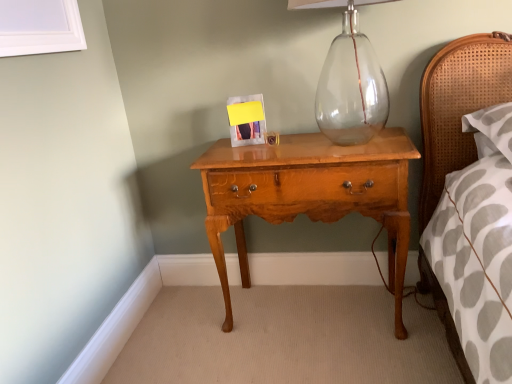
Where is `light brown wood nightstand at center`? This screenshot has width=512, height=384. light brown wood nightstand at center is located at coordinates (309, 194).

Describe the element at coordinates (309, 194) in the screenshot. I see `light brown wood nightstand at center` at that location.

What is the approximate width of yellow paper at center?

It is 2.78 inches.

Where is `yellow paper at center`? yellow paper at center is located at coordinates (246, 120).

Describe the element at coordinates (246, 120) in the screenshot. I see `yellow paper at center` at that location.

Where is `light brown wood nightstand at center`? light brown wood nightstand at center is located at coordinates (309, 194).

Considering the positions of objects yellow paper at center and light brown wood nightstand at center in the image provided, who is more to the right, yellow paper at center or light brown wood nightstand at center?

Positioned to the right is light brown wood nightstand at center.

From the picture: Between yellow paper at center and light brown wood nightstand at center, which one is positioned in front?

light brown wood nightstand at center.

Which point is more distant from viewer, (262, 116) or (388, 253)?

The point (388, 253) is farther from the camera.

From the image's perspective, between yellow paper at center and light brown wood nightstand at center, who is located below?

light brown wood nightstand at center, from the image's perspective.

From a real-world perspective, which object rests below the other?

In real-world perspective, light brown wood nightstand at center is lower.

Looking at their sizes, would you say yellow paper at center is wider or thinner than light brown wood nightstand at center?

Clearly, yellow paper at center has less width compared to light brown wood nightstand at center.

Considering the sizes of yellow paper at center and light brown wood nightstand at center in the image, is yellow paper at center taller or shorter than light brown wood nightstand at center?

yellow paper at center is shorter than light brown wood nightstand at center.

Based on their sizes in the image, would you say yellow paper at center is bigger or smaller than light brown wood nightstand at center?

Clearly, yellow paper at center is smaller in size than light brown wood nightstand at center.

Would you say yellow paper at center contains light brown wood nightstand at center?

No, light brown wood nightstand at center is located outside of yellow paper at center.

Is yellow paper at center not near light brown wood nightstand at center?

Actually, yellow paper at center and light brown wood nightstand at center are a little close together.

Is light brown wood nightstand at center at the back of yellow paper at center?

No, yellow paper at center is not facing the opposite direction of light brown wood nightstand at center.

How many degrees apart are the facing directions of yellow paper at center and light brown wood nightstand at center?

4.24 degrees separate the facing orientations of yellow paper at center and light brown wood nightstand at center.

This screenshot has height=384, width=512. In order to click on nightstand in front of the yellow paper at center in this screenshot , I will do pyautogui.click(x=309, y=194).

Considering the positions of objects light brown wood nightstand at center and yellow paper at center in the image provided, who is more to the right, light brown wood nightstand at center or yellow paper at center?

From the viewer's perspective, light brown wood nightstand at center appears more on the right side.

In the scene shown: Is light brown wood nightstand at center closer to the viewer compared to yellow paper at center?

Yes.

Between point (335, 219) and point (242, 100), which one is positioned behind?

The point (242, 100) is farther.

From the image's perspective, is light brown wood nightstand at center located beneath yellow paper at center?

Yes, from the image's perspective, light brown wood nightstand at center is below yellow paper at center.

From a real-world perspective, is light brown wood nightstand at center physically located above or below yellow paper at center?

Clearly, from a real-world perspective, light brown wood nightstand at center is below yellow paper at center.

Looking at their sizes, would you say light brown wood nightstand at center is wider or thinner than yellow paper at center?

light brown wood nightstand at center is wider than yellow paper at center.

In the scene shown: Who is taller, light brown wood nightstand at center or yellow paper at center?

light brown wood nightstand at center is taller.

Can you confirm if light brown wood nightstand at center is bigger than yellow paper at center?

Yes, light brown wood nightstand at center is bigger than yellow paper at center.

Is yellow paper at center a part of light brown wood nightstand at center?

No, yellow paper at center is not inside light brown wood nightstand at center.

Is there a large distance between light brown wood nightstand at center and yellow paper at center?

That's not correct — light brown wood nightstand at center is a little close to yellow paper at center.

Is light brown wood nightstand at center oriented towards yellow paper at center?

No, light brown wood nightstand at center is not aimed at yellow paper at center.

How different are the orientations of light brown wood nightstand at center and yellow paper at center in degrees?

They differ by 4.24 degrees in their facing directions.

Where is `nightstand located underneath the yellow paper at center (from a real-world perspective)`? Image resolution: width=512 pixels, height=384 pixels. nightstand located underneath the yellow paper at center (from a real-world perspective) is located at coordinates (309, 194).

At what (x,y) coordinates should I click in order to perform the action: click on picture frame above the light brown wood nightstand at center (from a real-world perspective). Please return your answer as a coordinate pair (x, y). Looking at the image, I should click on 246,120.

The width and height of the screenshot is (512, 384). Identify the location of nightstand below the yellow paper at center (from the image's perspective). (309, 194).